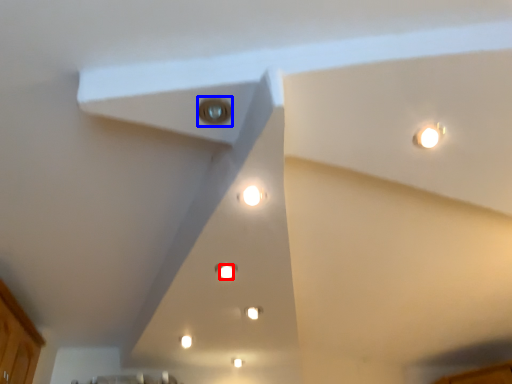
Question: Among these objects, which one is nearest to the camera, light (highlighted by a red box) or light (highlighted by a blue box)?

Choices:
 (A) light
 (B) light

Answer: (B)